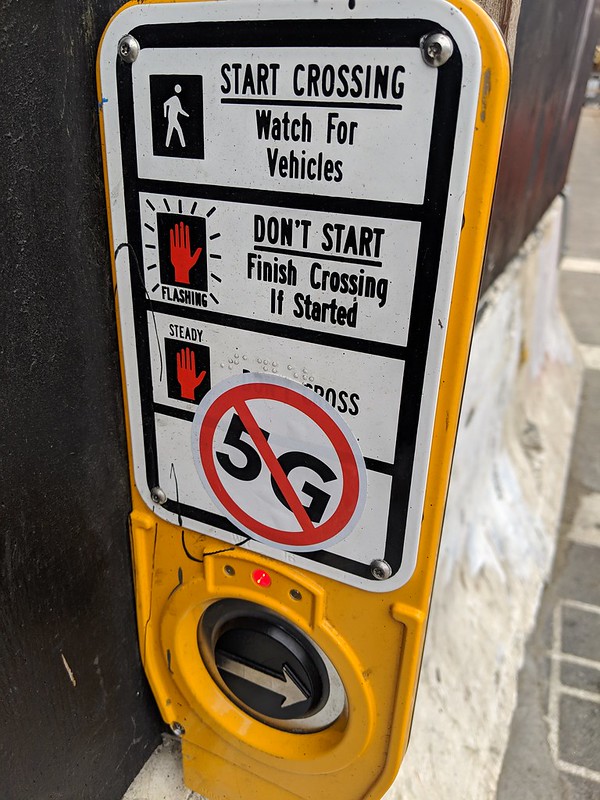
Find the location of a particular element. Image resolution: width=600 pixels, height=800 pixels. screws is located at coordinates (158, 498), (378, 568), (431, 54), (133, 53).